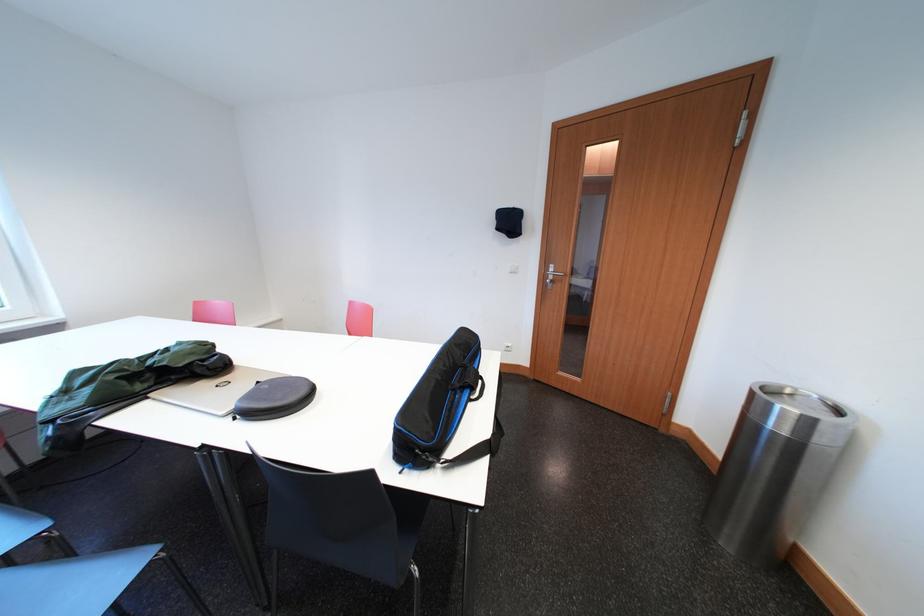
The location [274,398] corresponds to which object?

It refers to a black circular case.